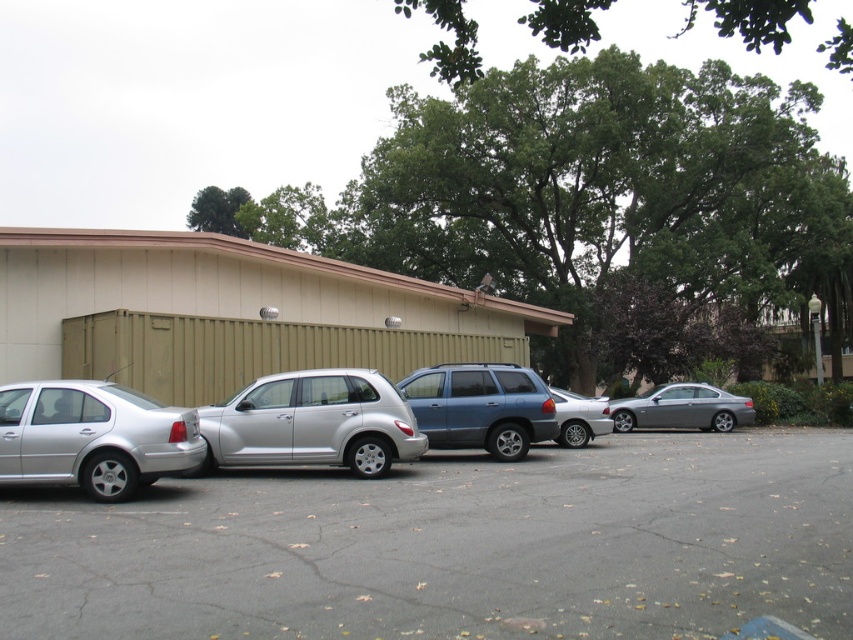
Question: Which object is the closest to the blue matte suv at center?

Choices:
 (A) silver metallic car at center
 (B) silver metallic sedan at left
 (C) satin silver sedan at right
 (D) silver metallic sedan at center

Answer: (D)

Question: Which object is closer to the camera taking this photo?

Choices:
 (A) satin silver sedan at right
 (B) silver metallic sedan at left
 (C) silver metallic sedan at center

Answer: (B)

Question: Does blue matte suv at center have a larger size compared to silver metallic sedan at center?

Choices:
 (A) no
 (B) yes

Answer: (B)

Question: Can you confirm if blue matte suv at center is smaller than silver metallic sedan at center?

Choices:
 (A) no
 (B) yes

Answer: (A)

Question: Can you confirm if blue matte suv at center is bigger than satin silver sedan at right?

Choices:
 (A) yes
 (B) no

Answer: (B)

Question: Among these objects, which one is farthest from the camera?

Choices:
 (A) blue matte suv at center
 (B) silver metallic car at center

Answer: (A)